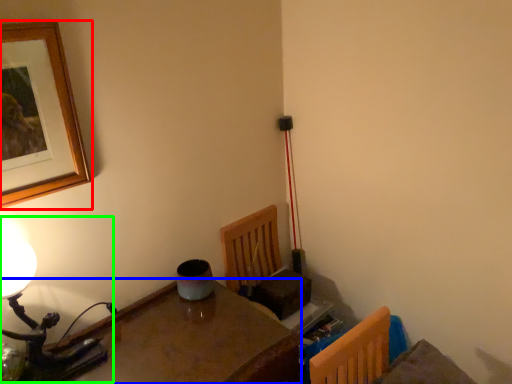
Question: Which object is positioned closest to picture frame (highlighted by a red box)? Select from table (highlighted by a blue box) and table lamp (highlighted by a green box).

Choices:
 (A) table
 (B) table lamp

Answer: (B)